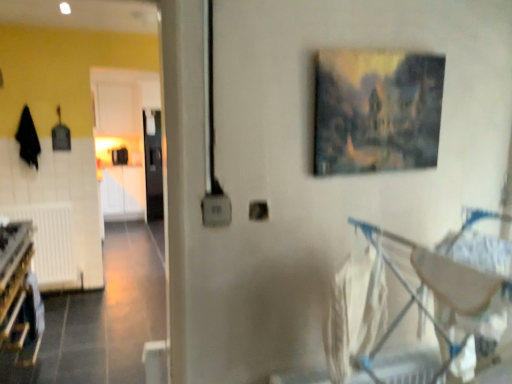
The height and width of the screenshot is (384, 512). Identify the location of white matte radiator at lower left. (50, 243).

Identify the location of white fabric laundry at lower right. (355, 313).

Identify the location of metallic silver baby carriage at lower right. Image resolution: width=512 pixels, height=384 pixels. (443, 285).

Describe the element at coordinates (376, 111) in the screenshot. I see `oil painting at upper center` at that location.

Identify the location of white matte radiator at lower left. (50, 243).

Looking at this image, considering the relative positions of oil painting at upper center and transparent glass door at center in the image provided, is oil painting at upper center in front of transparent glass door at center?

Yes, oil painting at upper center is closer to the camera.

In terms of height, does oil painting at upper center look taller or shorter compared to transparent glass door at center?

Clearly, oil painting at upper center is shorter compared to transparent glass door at center.

Does oil painting at upper center turn towards transparent glass door at center?

No, oil painting at upper center is not oriented towards transparent glass door at center.

From a real-world perspective, is white fabric laundry at lower right located beneath wooden bunk bed at lower left?

No, from a real-world perspective, white fabric laundry at lower right is not under wooden bunk bed at lower left.

Can you confirm if white fabric laundry at lower right is shorter than wooden bunk bed at lower left?

No, white fabric laundry at lower right is not shorter than wooden bunk bed at lower left.

Is white fabric laundry at lower right facing away from wooden bunk bed at lower left?

No, white fabric laundry at lower right is not facing away from wooden bunk bed at lower left.

This screenshot has height=384, width=512. What are the coordinates of `bunk bed below the white fabric laundry at lower right (from a real-world perspective)` in the screenshot? It's located at (19, 294).

From a real-world perspective, is white matte radiator at lower left positioned under metallic silver baby carriage at lower right based on gravity?

Yes.

Between white matte radiator at lower left and metallic silver baby carriage at lower right, which one appears on the right side from the viewer's perspective?

From the viewer's perspective, metallic silver baby carriage at lower right appears more on the right side.

Does transparent glass door at center have a lesser width compared to white matte radiator at lower left?

No, transparent glass door at center is not thinner than white matte radiator at lower left.

Which is nearer, (156, 123) or (21, 216)?

Point (156, 123) is positioned farther from the camera compared to point (21, 216).

Could you tell me if transparent glass door at center is turned towards white matte radiator at lower left?

No.

Which object is positioned more to the left, transparent glass door at center or white matte radiator at lower left?

white matte radiator at lower left.

Considering the relative sizes of metallic silver baby carriage at lower right and wooden bunk bed at lower left in the image provided, is metallic silver baby carriage at lower right bigger than wooden bunk bed at lower left?

Yes.

Is metallic silver baby carriage at lower right taller or shorter than wooden bunk bed at lower left?

In the image, metallic silver baby carriage at lower right appears to be taller than wooden bunk bed at lower left.

Which is closer, [464,293] or [24,232]?

Point [464,293] is positioned closer to the camera compared to point [24,232].

Where is `baby carriage that is above the wooden bunk bed at lower left (from a real-world perspective)`? The width and height of the screenshot is (512, 384). baby carriage that is above the wooden bunk bed at lower left (from a real-world perspective) is located at coordinates (443, 285).

From the image's perspective, is metallic silver baby carriage at lower right beneath oil painting at upper center?

Yes.

Consider the image. Is metallic silver baby carriage at lower right oriented towards oil painting at upper center?

No, metallic silver baby carriage at lower right is not aimed at oil painting at upper center.

Is metallic silver baby carriage at lower right spatially inside oil painting at upper center, or outside of it?

metallic silver baby carriage at lower right lies outside oil painting at upper center.

Considering the relative sizes of transparent glass door at center and white fabric laundry at lower right in the image provided, is transparent glass door at center bigger than white fabric laundry at lower right?

Yes, transparent glass door at center is bigger than white fabric laundry at lower right.

Does transparent glass door at center appear on the left side of white fabric laundry at lower right?

Yes, transparent glass door at center is to the left of white fabric laundry at lower right.

From a real-world perspective, is transparent glass door at center physically above white fabric laundry at lower right?

No, from a real-world perspective, transparent glass door at center is not above white fabric laundry at lower right.

The image size is (512, 384). Find the location of `glass door below the oil painting at upper center (from a real-world perspective)`. glass door below the oil painting at upper center (from a real-world perspective) is located at coordinates (153, 166).

Locate an element on the screen. laundry above the wooden bunk bed at lower left (from the image's perspective) is located at coordinates (355, 313).

From the image, which object appears to be farther from wooden bunk bed at lower left, transparent glass door at center or white fabric laundry at lower right?

Among the two, transparent glass door at center is located further to wooden bunk bed at lower left.

From the image, which object appears to be nearer to white matte radiator at lower left, transparent glass door at center or metallic silver baby carriage at lower right?

transparent glass door at center lies closer to white matte radiator at lower left than the other object.

Estimate the real-world distances between objects in this image. Which object is further from oil painting at upper center, white fabric laundry at lower right or metallic silver baby carriage at lower right?

white fabric laundry at lower right lies further to oil painting at upper center than the other object.

When comparing their distances from oil painting at upper center, does white fabric laundry at lower right or white matte radiator at lower left seem closer?

white fabric laundry at lower right is closer to oil painting at upper center.

Considering their positions, is white fabric laundry at lower right positioned further to white matte radiator at lower left than oil painting at upper center?

The object further to white matte radiator at lower left is oil painting at upper center.

When comparing their distances from white fabric laundry at lower right, does white matte radiator at lower left or transparent glass door at center seem closer?

white matte radiator at lower left is closer to white fabric laundry at lower right.

When comparing their distances from white fabric laundry at lower right, does white matte radiator at lower left or oil painting at upper center seem further?

Among the two, white matte radiator at lower left is located further to white fabric laundry at lower right.

Based on the photo, when comparing their distances from white fabric laundry at lower right, does white matte radiator at lower left or wooden bunk bed at lower left seem further?

The object further to white fabric laundry at lower right is white matte radiator at lower left.

In order to click on bunk bed located between white matte radiator at lower left and oil painting at upper center in the left-right direction in this screenshot , I will do `click(19, 294)`.

At what (x,y) coordinates should I click in order to perform the action: click on laundry positioned between metallic silver baby carriage at lower right and transparent glass door at center from near to far. Please return your answer as a coordinate pair (x, y). Looking at the image, I should click on (355, 313).

Where is `bunk bed between white fabric laundry at lower right and transparent glass door at center in the front-back direction`? The height and width of the screenshot is (384, 512). bunk bed between white fabric laundry at lower right and transparent glass door at center in the front-back direction is located at coordinates (19, 294).

This screenshot has height=384, width=512. Identify the location of bunk bed between metallic silver baby carriage at lower right and white matte radiator at lower left along the z-axis. (19, 294).